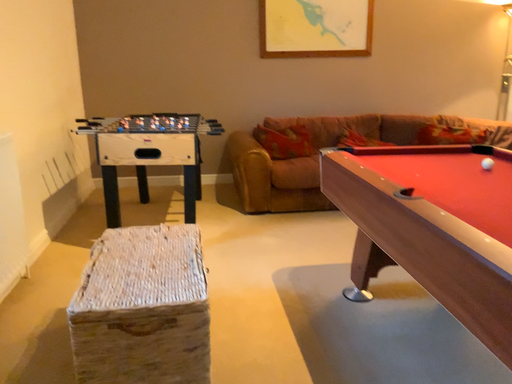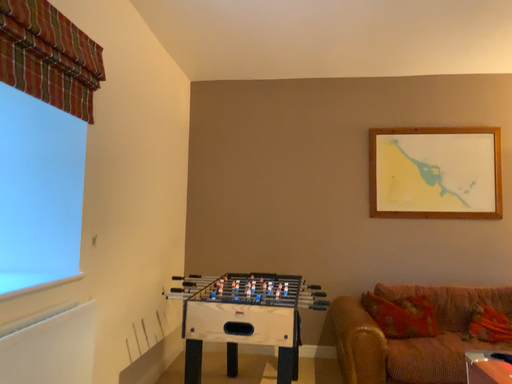
Question: Which way did the camera rotate in the video?

Choices:
 (A) rotated downward
 (B) rotated upward

Answer: (B)